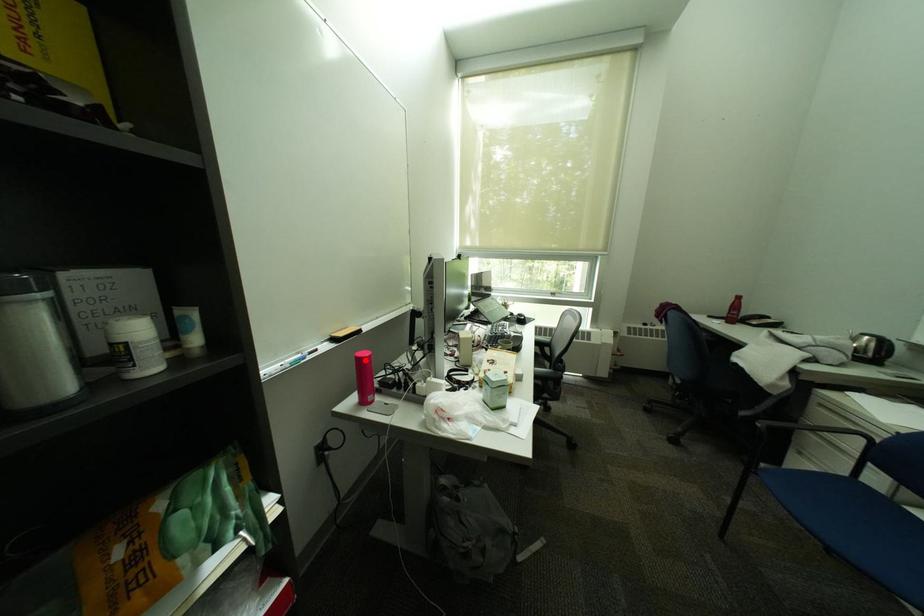
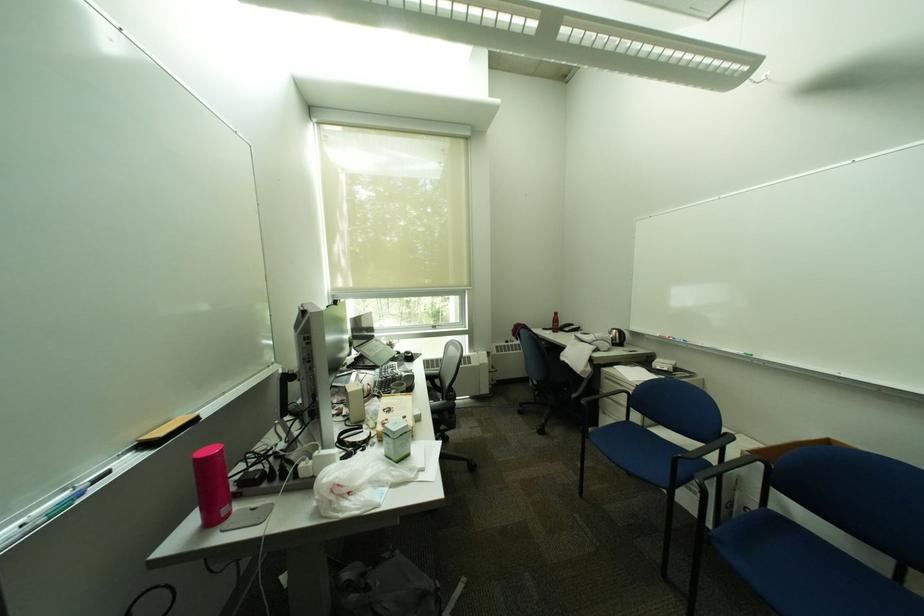
Find the pixel in the second image that matches the highlighted location in the first image.

(202, 464)